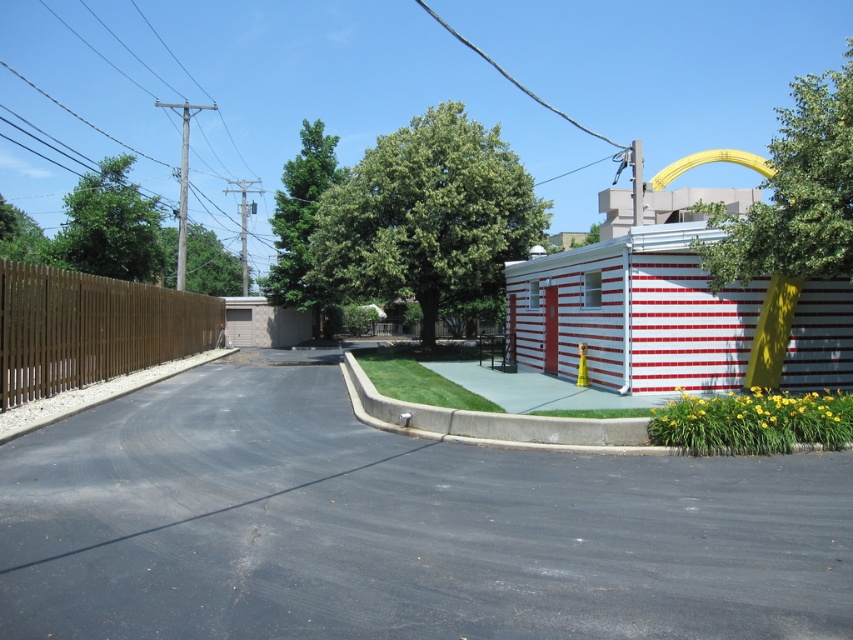
You are a delivery driver who needs to park your vehicle on the black asphalt driveway at center. However, there is a brown textured garage door at left nearby. Based on the scene, can you determine if the driveway is to the right or left of the garage door?

The black asphalt driveway at center is positioned on the right side of brown textured garage door at left, so the driveway is to the right of the garage door.

You are standing at point A and want to walk to the brown wooden fence at left. Which direction should you go?

You should go to the left to reach the brown wooden fence at left.

You are driving a delivery truck that is 2.5 meters wide. You need to pass through the area between the black asphalt driveway at center and the brown wooden fence at left. Can your truck fit through this space?

The black asphalt driveway at center is positioned under the brown wooden fence at left, which means they are aligned vertically. Since the truck is 2.5 meters wide and the space between them is not specified to be narrower than that, the truck should be able to pass through as long as there are no other obstacles.